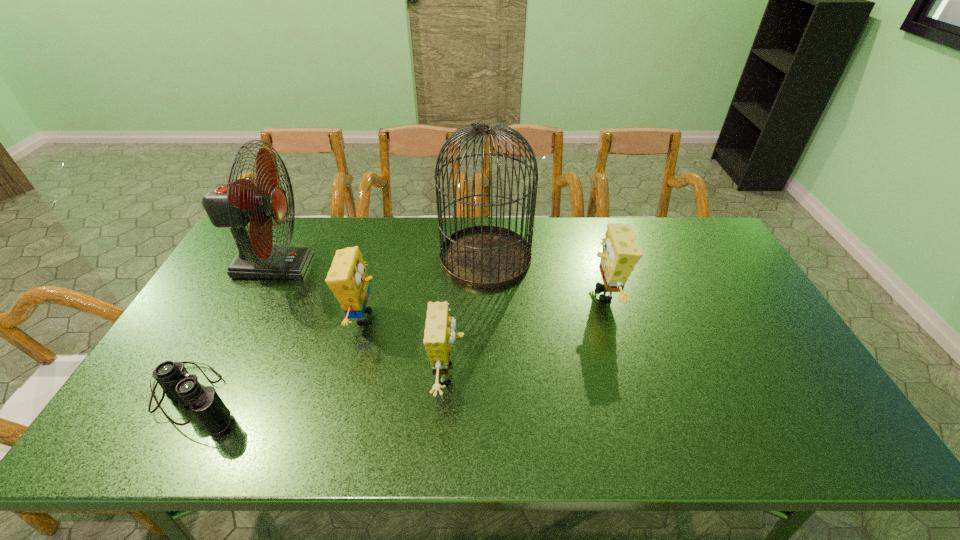
The image size is (960, 540). Find the location of `birdcage`. birdcage is located at coordinates click(485, 256).

Identify the location of fan. The image size is (960, 540). (233, 205).

Locate an element on the screen. The width and height of the screenshot is (960, 540). the rightmost object is located at coordinates (621, 252).

Locate an element on the screen. The width and height of the screenshot is (960, 540). the third object from left to right is located at coordinates (347, 278).

Where is `the second sponge from left to right`? This screenshot has height=540, width=960. the second sponge from left to right is located at coordinates (439, 335).

This screenshot has width=960, height=540. Identify the location of binoculars. (179, 386).

Where is `free space located on the front of the birdcage`? Image resolution: width=960 pixels, height=540 pixels. free space located on the front of the birdcage is located at coordinates (488, 399).

Locate an element on the screen. Image resolution: width=960 pixels, height=540 pixels. vacant region located on the front-facing side of the fan is located at coordinates (327, 266).

Locate an element on the screen. This screenshot has width=960, height=540. vacant space located on the face of the rightmost sponge is located at coordinates (493, 294).

Locate an element on the screen. The width and height of the screenshot is (960, 540). vacant area situated 0.200m on the face of the rightmost sponge is located at coordinates (522, 294).